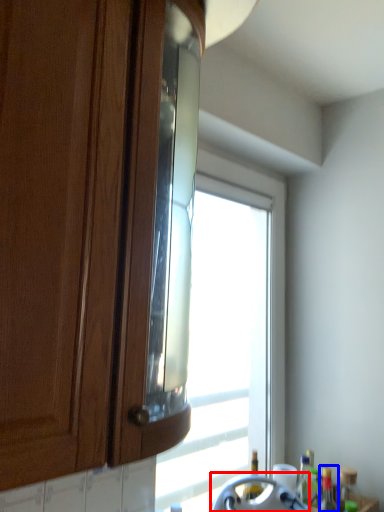
Question: Which object is closer to the camera taking this photo, appliance (highlighted by a red box) or bottle (highlighted by a blue box)?

Choices:
 (A) appliance
 (B) bottle

Answer: (A)